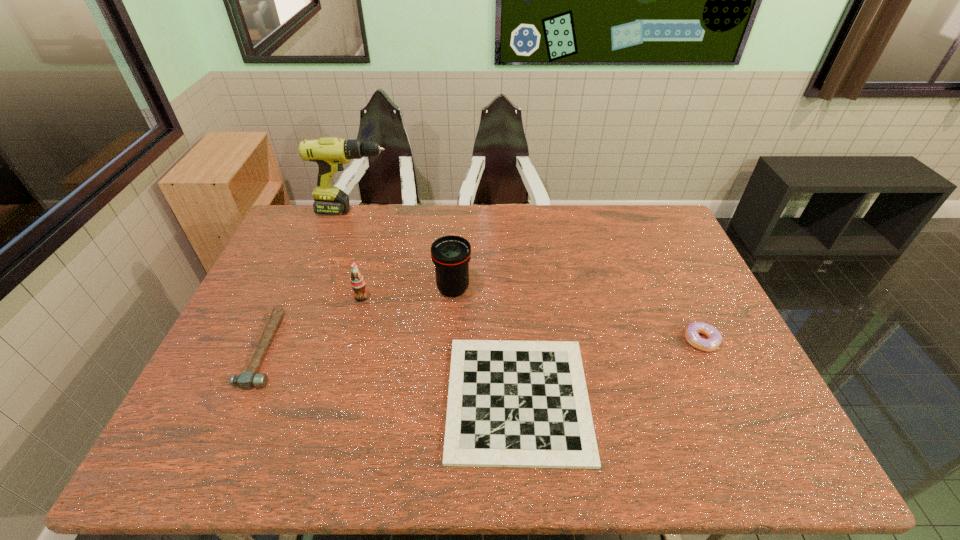
This screenshot has width=960, height=540. What are the coordinates of `the tallest object` in the screenshot? It's located at (330, 153).

You are a GUI agent. You are given a task and a screenshot of the screen. Output one action in this format:
    pyautogui.click(x=<x>, y=<y>)
    Task: Click on the drill
    Image resolution: width=960 pixels, height=540 pixels.
    Given the screenshot: What is the action you would take?
    pyautogui.click(x=330, y=153)

Image resolution: width=960 pixels, height=540 pixels. Identify the location of telephoto lens. (451, 254).

Where is `the third tallest object`? The width and height of the screenshot is (960, 540). the third tallest object is located at coordinates (357, 281).

I want to click on doughnut, so click(714, 336).

What are the coordinates of `the fourth tallest object` in the screenshot? It's located at (714, 336).

I want to click on hammer, so click(246, 380).

Identify the location of the shortest object. (525, 404).

The image size is (960, 540). I want to click on free space located on the handle side of the drill, so click(x=447, y=211).

This screenshot has height=540, width=960. What are the coordinates of `free space located 0.240m on the front of the telephoto lens` in the screenshot? It's located at [x=448, y=369].